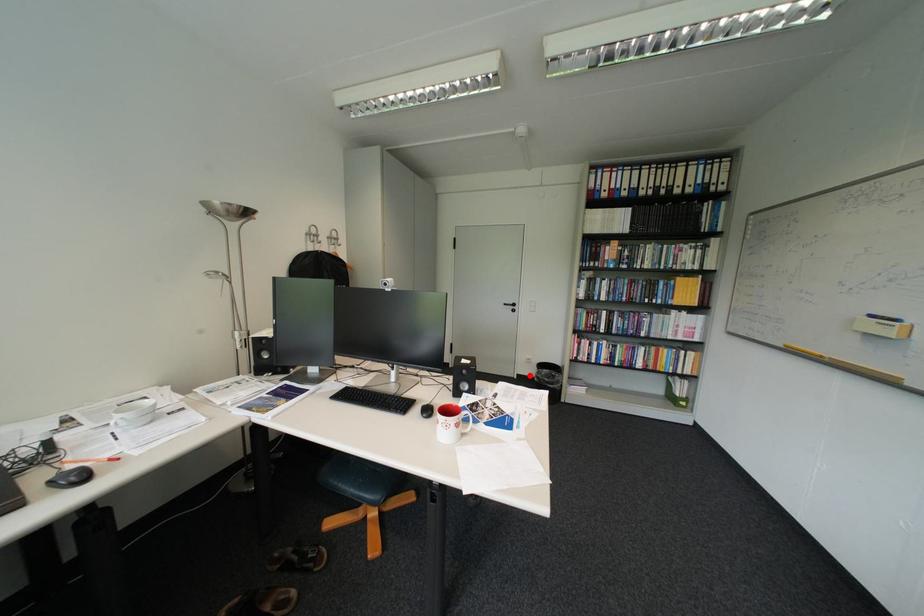
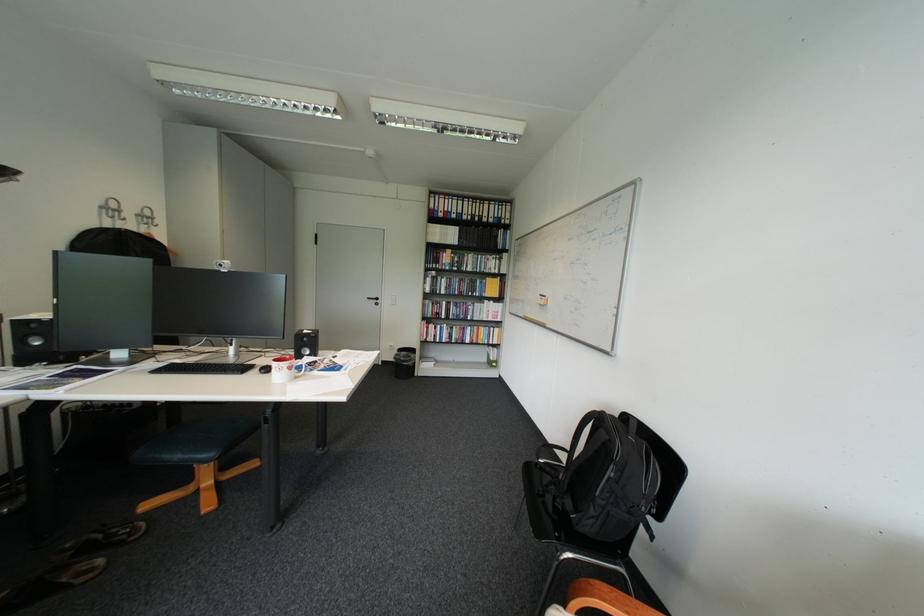
The point at the highlighted location is marked in the first image. Where is the corresponding point in the second image?

(395, 362)